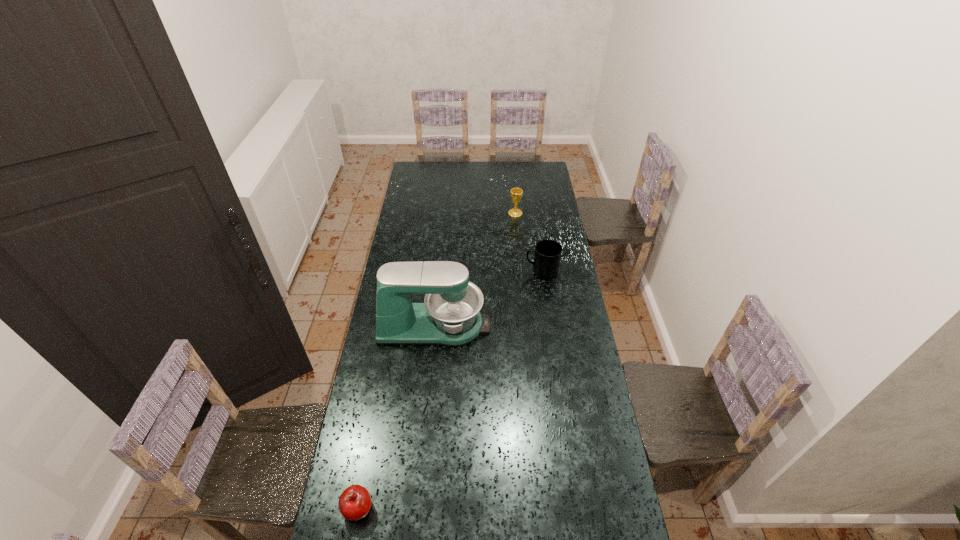
I want to click on the closest object to the third nearest object, so click(449, 316).

Locate an element on the screen. This screenshot has height=540, width=960. the third closest object relative to the second farthest object is located at coordinates (354, 503).